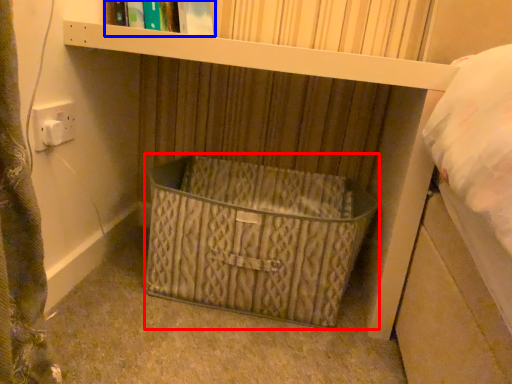
Question: Among these objects, which one is farthest to the camera, basket (highlighted by a red box) or book (highlighted by a blue box)?

Choices:
 (A) basket
 (B) book

Answer: (B)